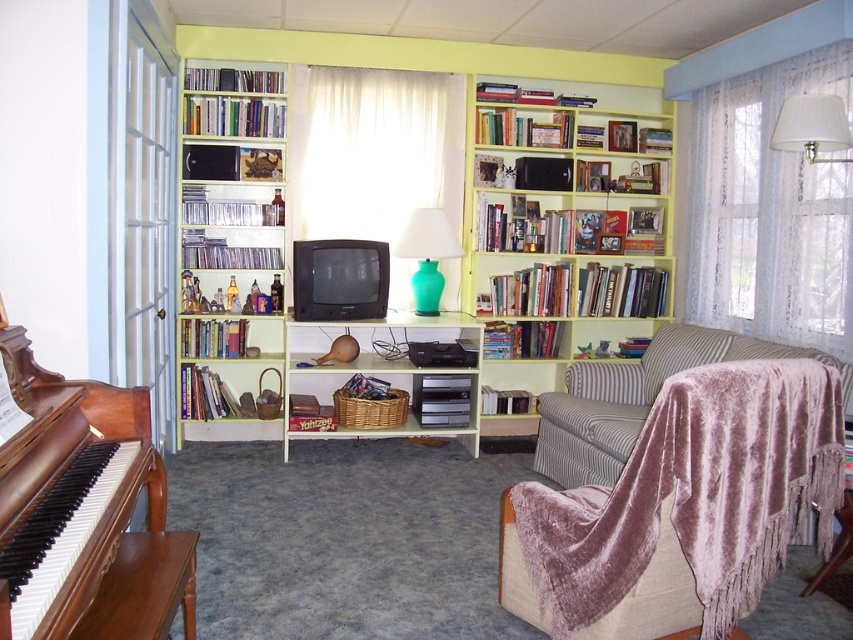
Which is more to the left, velvet beige armchair at lower right or white lace curtain at right?

velvet beige armchair at lower right is more to the left.

Which is more to the right, velvet beige armchair at lower right or white lace curtain at right?

white lace curtain at right is more to the right.

Identify the location of velvet beige armchair at lower right. (689, 499).

Image resolution: width=853 pixels, height=640 pixels. I want to click on velvet beige armchair at lower right, so click(689, 499).

Does striped fabric armchair at right appear on the right side of teal glass lamp at center?

Correct, you'll find striped fabric armchair at right to the right of teal glass lamp at center.

Who is more forward, (x=631, y=403) or (x=409, y=230)?

Point (x=631, y=403) is more forward.

Does point (566, 460) lie behind point (425, 209)?

No, (566, 460) is closer to viewer.

Identify the location of striped fabric armchair at right. The height and width of the screenshot is (640, 853). point(636,397).

Who is taller, white sheer curtain at center or wicker basket at center?

Standing taller between the two is white sheer curtain at center.

Image resolution: width=853 pixels, height=640 pixels. What do you see at coordinates (369, 157) in the screenshot?
I see `white sheer curtain at center` at bounding box center [369, 157].

You are a GUI agent. You are given a task and a screenshot of the screen. Output one action in this format:
    pyautogui.click(x=<x>, y=<y>)
    Task: Click on the white sheer curtain at center
    This screenshot has height=640, width=853.
    Given the screenshot: What is the action you would take?
    pyautogui.click(x=369, y=157)